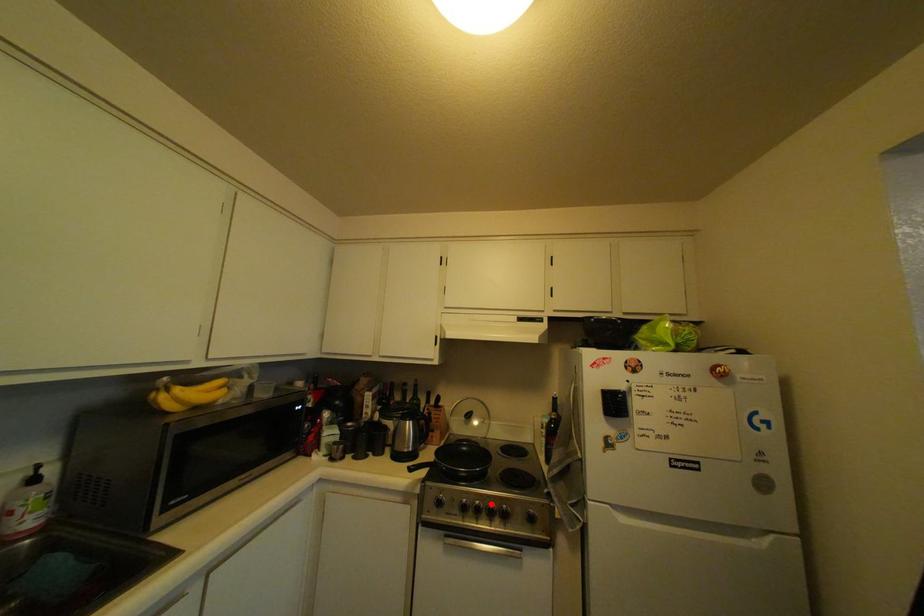
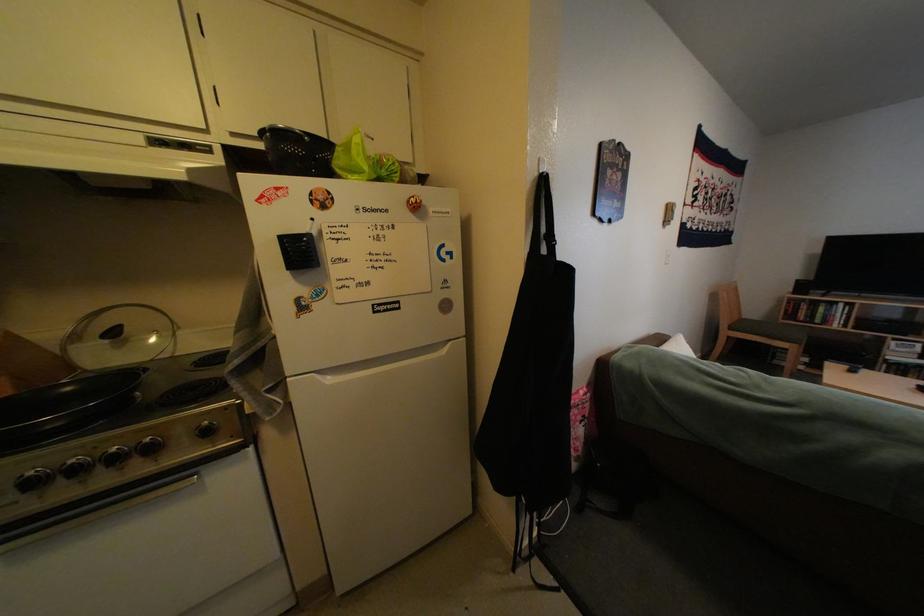
The point at the highlighted location is marked in the first image. Where is the corresponding point in the second image?

(88, 463)